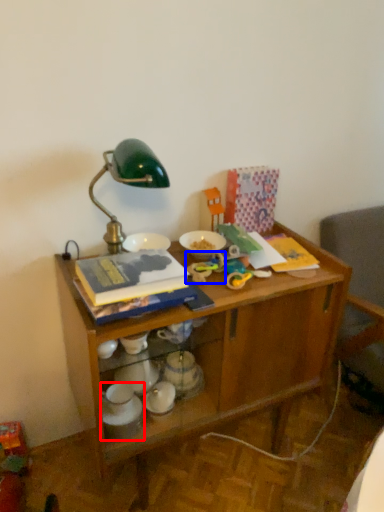
Question: Among these objects, which one is nearest to the camera, tableware (highlighted by a red box) or toy (highlighted by a blue box)?

Choices:
 (A) tableware
 (B) toy

Answer: (A)